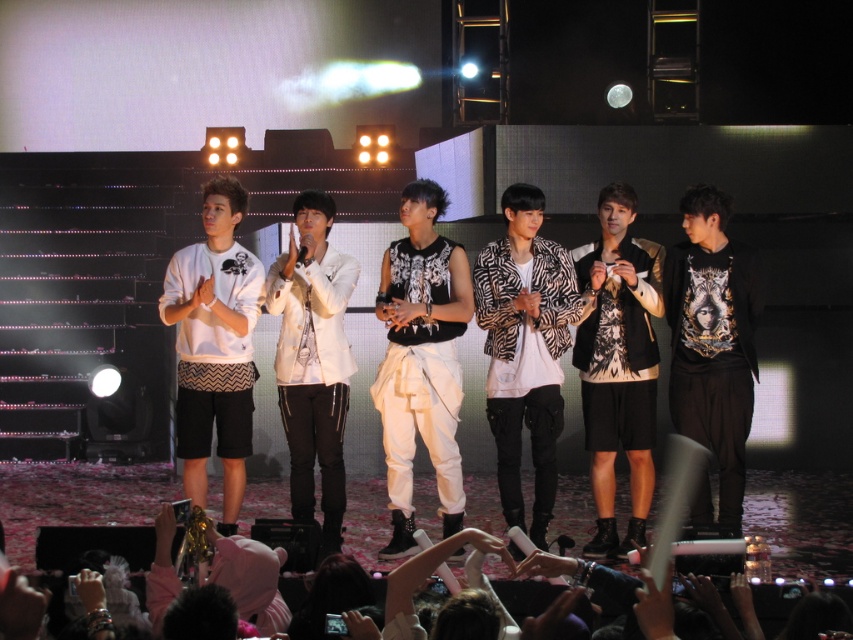
Question: Is white matte pants at center positioned at the back of printed jersey at center?

Choices:
 (A) no
 (B) yes

Answer: (B)

Question: Can you confirm if white matte jacket at center is positioned to the right of pink fabric at lower center?

Choices:
 (A) no
 (B) yes

Answer: (B)

Question: Which object is positioned closest to the white matte jacket at center?

Choices:
 (A) black printed hoodie at right
 (B) printed jersey at center
 (C) pink fabric at lower center

Answer: (B)

Question: Is black printed hoodie at right positioned in front of white matte jacket at center?

Choices:
 (A) yes
 (B) no

Answer: (A)

Question: Among these points, which one is nearest to the camera?

Choices:
 (A) (192, 442)
 (B) (315, 300)
 (C) (450, 352)
 (D) (639, 392)

Answer: (A)

Question: Which of the following is the farthest from the observer?

Choices:
 (A) (271, 300)
 (B) (456, 358)

Answer: (B)